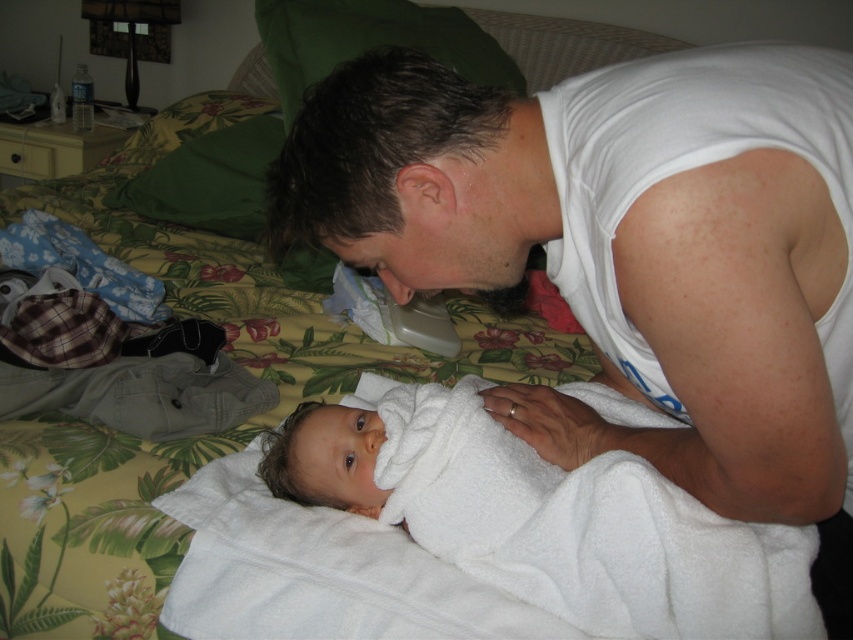
Does white cotton tank top at upper right have a lesser width compared to white soft towel at center?

No.

Between white cotton tank top at upper right and white soft towel at center, which one is positioned lower?

white soft towel at center is lower down.

Is point (485, 202) positioned before point (722, 531)?

No, (485, 202) is further to viewer.

Where is `white cotton tank top at upper right`? white cotton tank top at upper right is located at coordinates (621, 244).